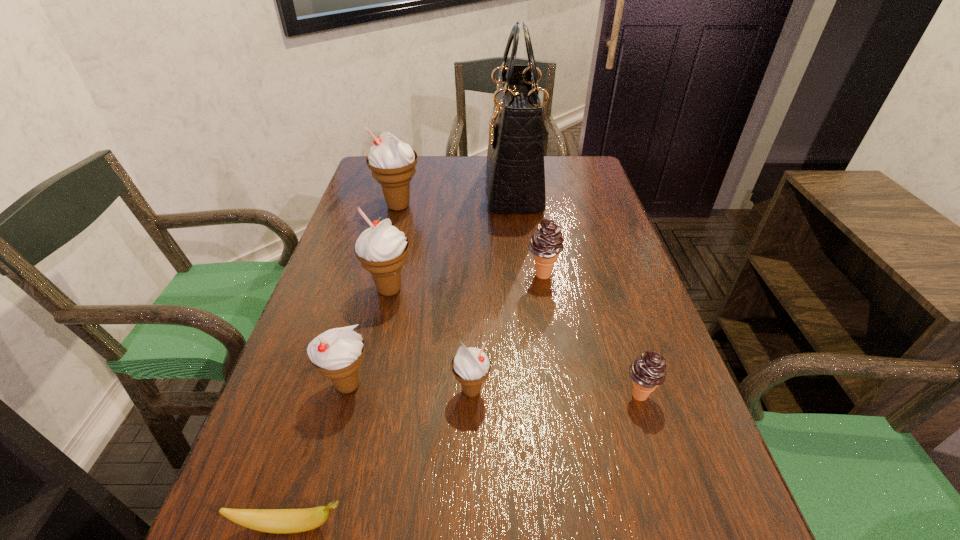
You are a GUI agent. You are given a task and a screenshot of the screen. Output one action in this format:
    pyautogui.click(x=<x>, y=<y>)
    Task: Click on the free location that satisfies the following two spatial constraints: 1. on the front side of the biggest white icecream; 2. on the left side of the rightmost white icecream
    The image size is (960, 540).
    Given the screenshot: What is the action you would take?
    pyautogui.click(x=350, y=390)

The height and width of the screenshot is (540, 960). I want to click on free space that satisfies the following two spatial constraints: 1. on the back side of the bigger chocolate icecream; 2. on the left side of the sixth shortest object, so click(393, 274).